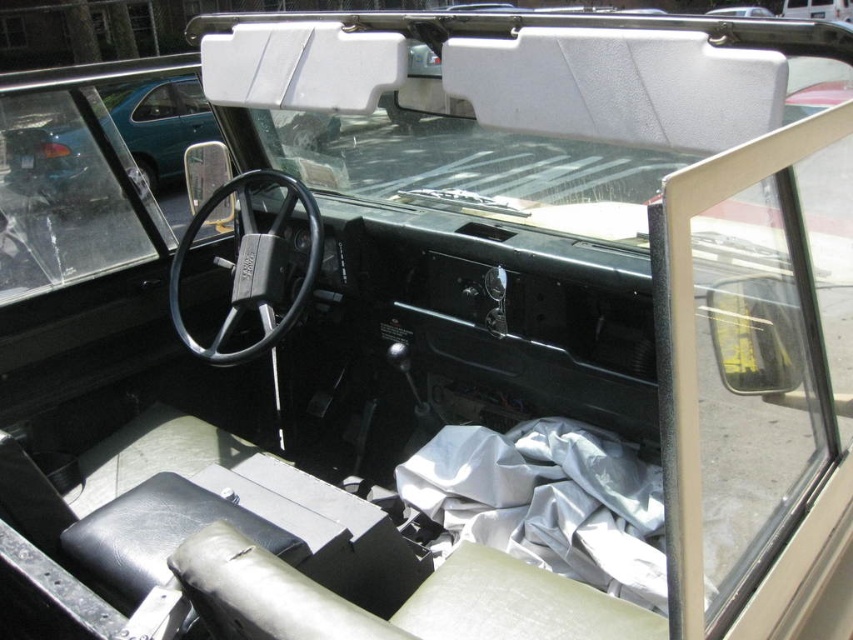
Question: Does white matte windshield at center appear on the right side of white fabric at center?

Choices:
 (A) no
 (B) yes

Answer: (A)

Question: Is white matte windshield at center positioned behind white fabric at center?

Choices:
 (A) yes
 (B) no

Answer: (B)

Question: Does white matte windshield at center appear on the right side of white fabric at center?

Choices:
 (A) no
 (B) yes

Answer: (A)

Question: Which of the following is the farthest from the observer?

Choices:
 (A) 747,92
 (B) 445,502

Answer: (B)

Question: Which point is closer to the camera?

Choices:
 (A) (506, 460)
 (B) (425, 166)

Answer: (A)